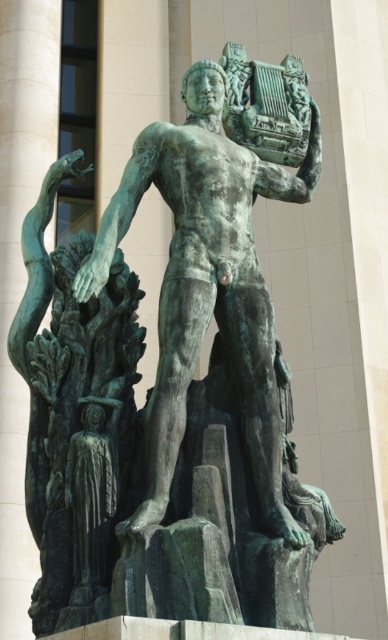
Question: Can you confirm if green patina statue at center is thinner than green patina tree at left?

Choices:
 (A) yes
 (B) no

Answer: (B)

Question: Which object appears closest to the camera in this image?

Choices:
 (A) green patina statue at center
 (B) green patina tree at left

Answer: (A)

Question: Which point appears closest to the camera in this image?

Choices:
 (A) coord(57,486)
 (B) coord(259,509)

Answer: (B)

Question: From the image, what is the correct spatial relationship of green patina statue at center in relation to green patina tree at left?

Choices:
 (A) above
 (B) below

Answer: (A)

Question: Can you confirm if green patina statue at center is thinner than green patina tree at left?

Choices:
 (A) yes
 (B) no

Answer: (B)